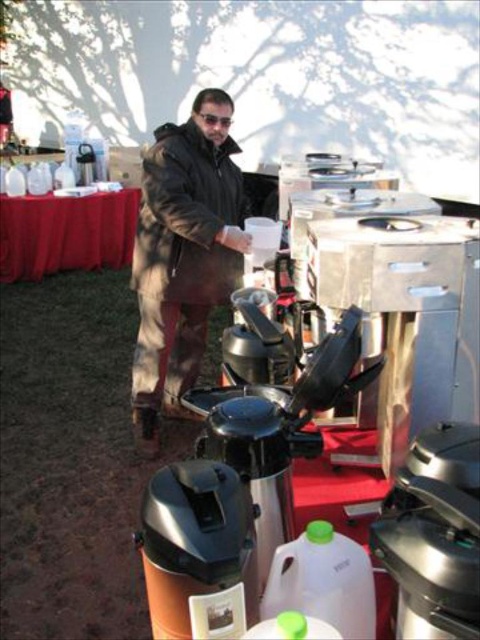
You are at a coffee station and need to reach the orange matte thermos at center to refill your cup. The black leather jacket at center is in your way. Can you move the jacket to access the thermos?

The orange matte thermos at center is behind the black leather jacket at center, so you can move the jacket to access the thermos.

You are at the coffee station and need to pour coffee into your cup. Where exactly is the stainless steel coffee maker at center located in relation to the other items?

The stainless steel coffee maker at center is located at point coordinates (406, 314).